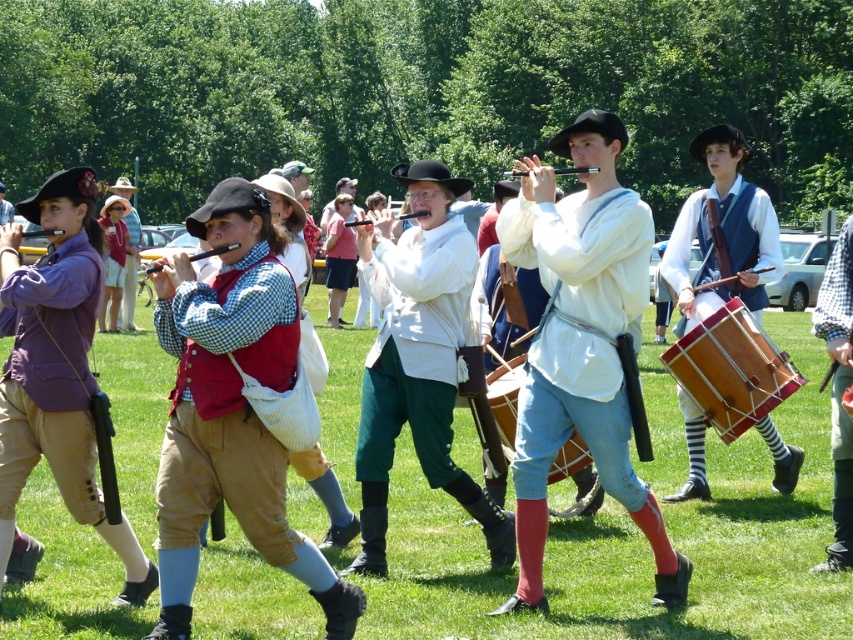
You are standing at the center of the scene and want to find the matte white shirt at center. According to the coordinates provided, in which direction should you look to locate it?

The matte white shirt at center is located at coordinates point (581, 342), which is slightly to the right and below the center point of the scene.

You are standing at the point with coordinates point (68, 301) and want to walk towards the point with coordinates point (619, 374). Will you be moving forward or backward in the scene?

Point (619, 374) is behind point (68, 301), so moving towards it would mean moving backward in the scene.

You are a photographer positioned in front of the group. You need to capture a photo where both the purple cotton vest at left and the wooden drum at right are visible. Based on their positions, which object should you ensure is closer to the center of the frame to include both in the shot?

Since the purple cotton vest at left is to the left of wooden drum at right, you should center the frame between both objects to include both in the shot.